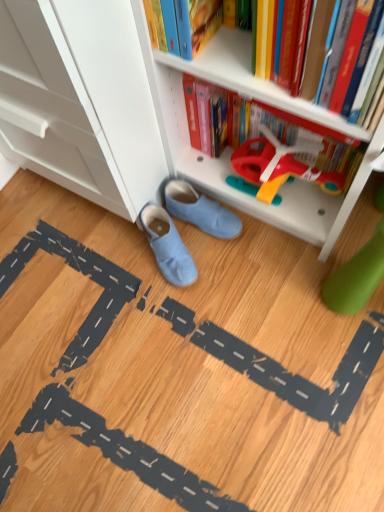
The height and width of the screenshot is (512, 384). In order to click on blank space to the left of light blue suede shoes at center, which appears as the second footwear when viewed from the top in this screenshot , I will do `click(103, 273)`.